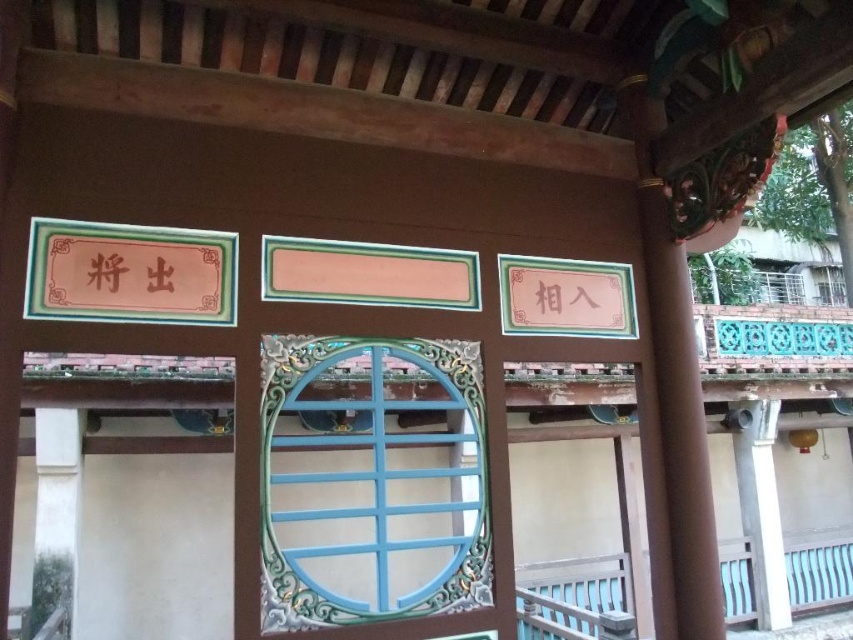
Which of these two, blue painted wood window at center or white plastic balustrade at lower right, stands taller?

blue painted wood window at center is taller.

Can you confirm if blue painted wood window at center is positioned below white plastic balustrade at lower right?

Actually, blue painted wood window at center is above white plastic balustrade at lower right.

What do you see at coordinates (370, 481) in the screenshot? The width and height of the screenshot is (853, 640). I see `blue painted wood window at center` at bounding box center [370, 481].

Locate an element on the screen. This screenshot has height=640, width=853. blue painted wood window at center is located at coordinates (370, 481).